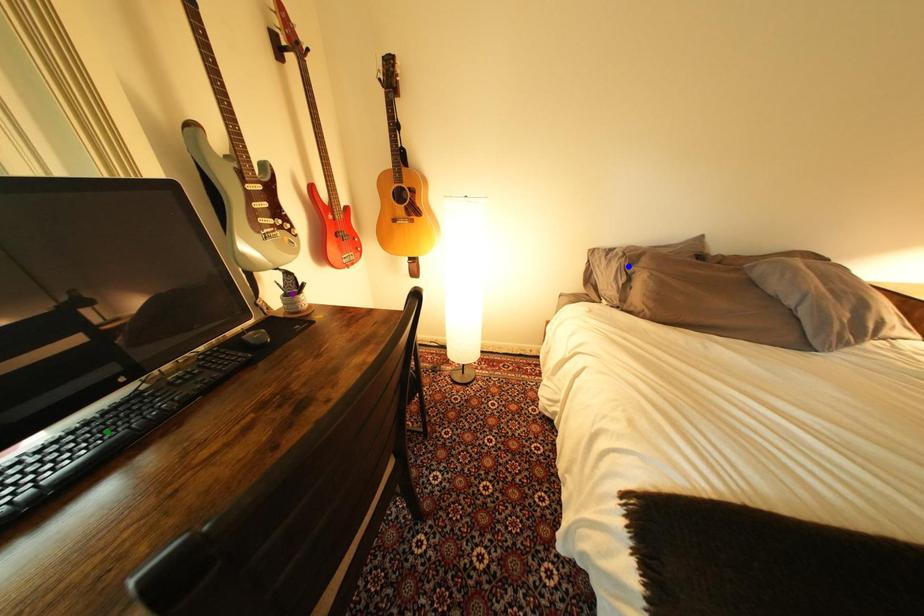
Based on the photo, order these from farthest to nearest:
1. green point
2. blue point
3. purple point

blue point → purple point → green point